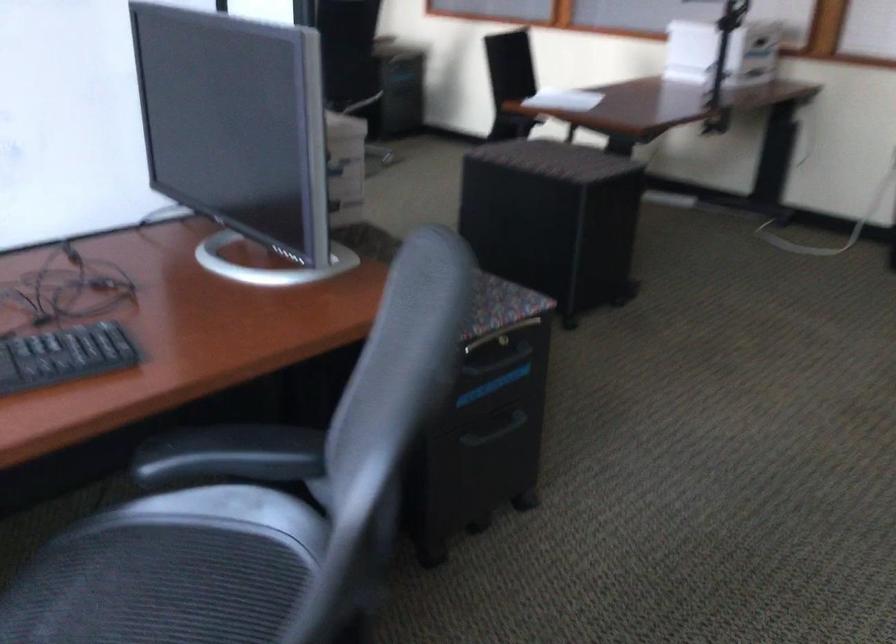
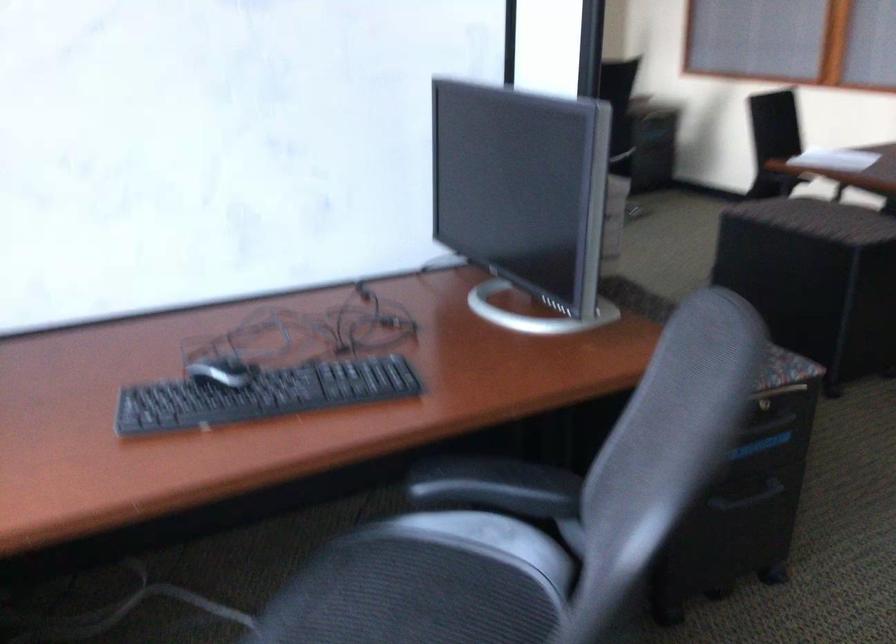
In a continuous first-person perspective shot, in which direction is the camera moving?

The cameraman walked toward left, backward.